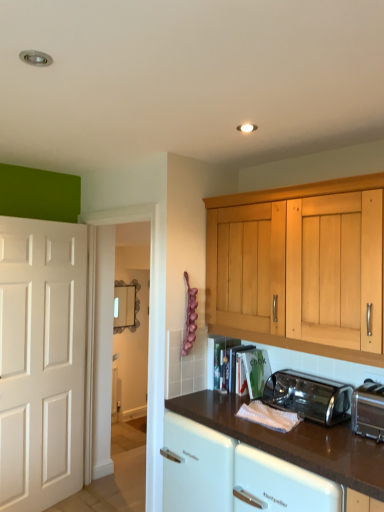
Question: Considering the relative positions of brown glossy countertop at lower center and silver metallic toaster at lower right, marked as the first toaster in a front-to-back arrangement, in the image provided, is brown glossy countertop at lower center to the right of silver metallic toaster at lower right, marked as the first toaster in a front-to-back arrangement, from the viewer's perspective?

Choices:
 (A) yes
 (B) no

Answer: (B)

Question: Could you tell me if brown glossy countertop at lower center is turned towards silver metallic toaster at lower right, arranged as the 2th toaster when viewed from the back?

Choices:
 (A) no
 (B) yes

Answer: (A)

Question: From the image's perspective, does brown glossy countertop at lower center appear lower than silver metallic toaster at lower right, marked as the first toaster in a front-to-back arrangement?

Choices:
 (A) yes
 (B) no

Answer: (A)

Question: Is brown glossy countertop at lower center shorter than silver metallic toaster at lower right, marked as the first toaster in a front-to-back arrangement?

Choices:
 (A) no
 (B) yes

Answer: (A)

Question: Is the position of brown glossy countertop at lower center more distant than that of silver metallic toaster at lower right, arranged as the 2th toaster when viewed from the back?

Choices:
 (A) yes
 (B) no

Answer: (B)

Question: Is brown glossy countertop at lower center far away from silver metallic toaster at lower right, arranged as the 2th toaster when viewed from the back?

Choices:
 (A) yes
 (B) no

Answer: (B)

Question: Can we say brown glossy countertop at lower center lies outside polished stainless steel toaster at lower center, the 1th toaster when ordered from back to front?

Choices:
 (A) no
 (B) yes

Answer: (B)

Question: Is brown glossy countertop at lower center turned away from polished stainless steel toaster at lower center, the 1th toaster when ordered from back to front?

Choices:
 (A) yes
 (B) no

Answer: (B)

Question: Can you confirm if brown glossy countertop at lower center is bigger than polished stainless steel toaster at lower center, the 1th toaster when ordered from back to front?

Choices:
 (A) yes
 (B) no

Answer: (A)

Question: Does brown glossy countertop at lower center contain polished stainless steel toaster at lower center, the 1th toaster when ordered from back to front?

Choices:
 (A) yes
 (B) no

Answer: (B)

Question: Is brown glossy countertop at lower center at the left side of polished stainless steel toaster at lower center, which is the second toaster from front to back?

Choices:
 (A) yes
 (B) no

Answer: (A)

Question: Does brown glossy countertop at lower center appear on the right side of polished stainless steel toaster at lower center, which is the second toaster from front to back?

Choices:
 (A) no
 (B) yes

Answer: (A)

Question: From a real-world perspective, is silver metallic toaster at lower right, arranged as the 2th toaster when viewed from the back, located beneath polished stainless steel toaster at lower center, the 1th toaster when ordered from back to front?

Choices:
 (A) yes
 (B) no

Answer: (B)